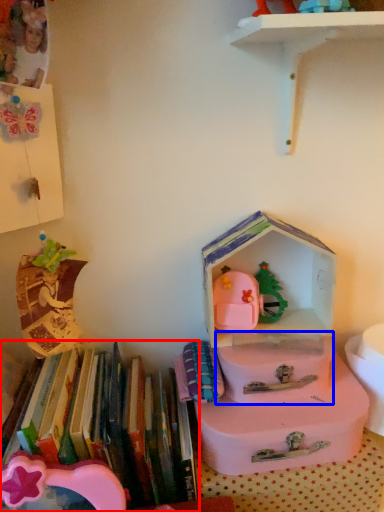
Question: Which object is closer to the camera taking this photo, book (highlighted by a red box) or box (highlighted by a blue box)?

Choices:
 (A) book
 (B) box

Answer: (A)